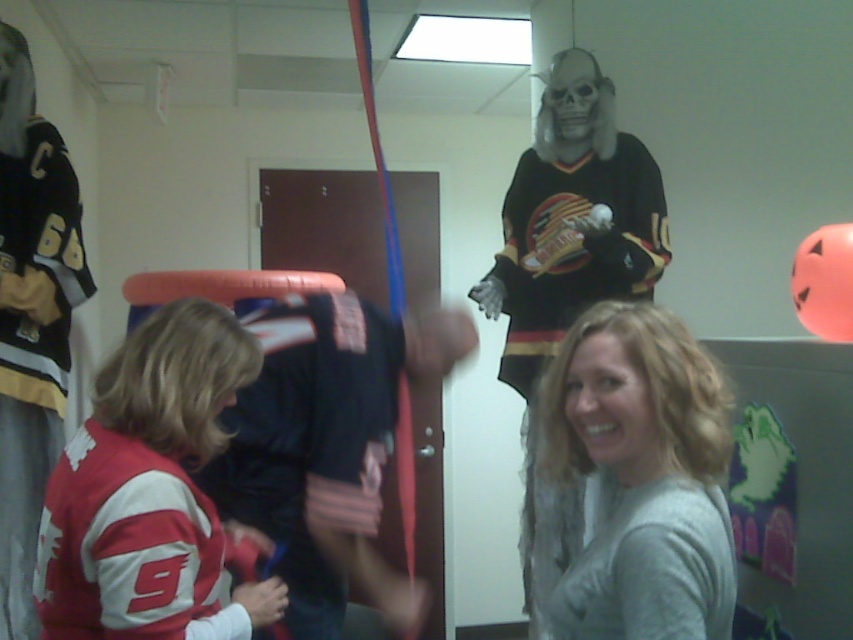
What do you see at coordinates (32, 320) in the screenshot? The height and width of the screenshot is (640, 853). I see `matte black jersey at left` at bounding box center [32, 320].

Between point (80, 252) and point (579, 112), which one is positioned behind?

The point (579, 112) is more distant.

Locate an element on the screen. The image size is (853, 640). matte black jersey at left is located at coordinates (32, 320).

Can you confirm if smooth skin face at center is taller than smooth plastic skull at upper center?

No, smooth skin face at center is not taller than smooth plastic skull at upper center.

Is point (589, 355) positioned behind point (590, 116)?

No.

The image size is (853, 640). Find the location of `smooth skin face at center`. smooth skin face at center is located at coordinates (611, 408).

Describe the element at coordinates (149, 492) in the screenshot. The height and width of the screenshot is (640, 853). I see `red and white jersey at left` at that location.

Between red and white jersey at left and matte black jersey at left, which one appears on the right side from the viewer's perspective?

Positioned to the right is red and white jersey at left.

At what (x,y) coordinates should I click in order to perform the action: click on red and white jersey at left. Please return your answer as a coordinate pair (x, y). Looking at the image, I should click on (149, 492).